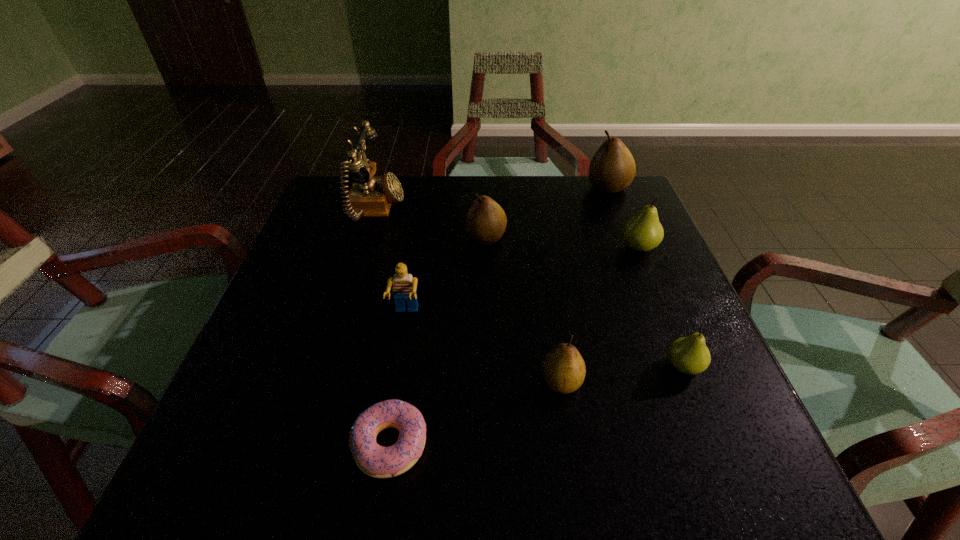
Where is `vacant point that satisfies the following two spatial constraints: 1. on the back side of the second biggest brown pear; 2. on the dial number of the telephone`? This screenshot has height=540, width=960. vacant point that satisfies the following two spatial constraints: 1. on the back side of the second biggest brown pear; 2. on the dial number of the telephone is located at coordinates (486, 210).

Find the location of a particular element. This screenshot has width=960, height=540. vacant space that satisfies the following two spatial constraints: 1. on the face of the fifth object from left to right; 2. on the right side of the blue Lego is located at coordinates (396, 381).

Where is `free location that satisfies the following two spatial constraints: 1. on the front side of the tallest pear; 2. on the dial number of the leftmost object`? free location that satisfies the following two spatial constraints: 1. on the front side of the tallest pear; 2. on the dial number of the leftmost object is located at coordinates (617, 210).